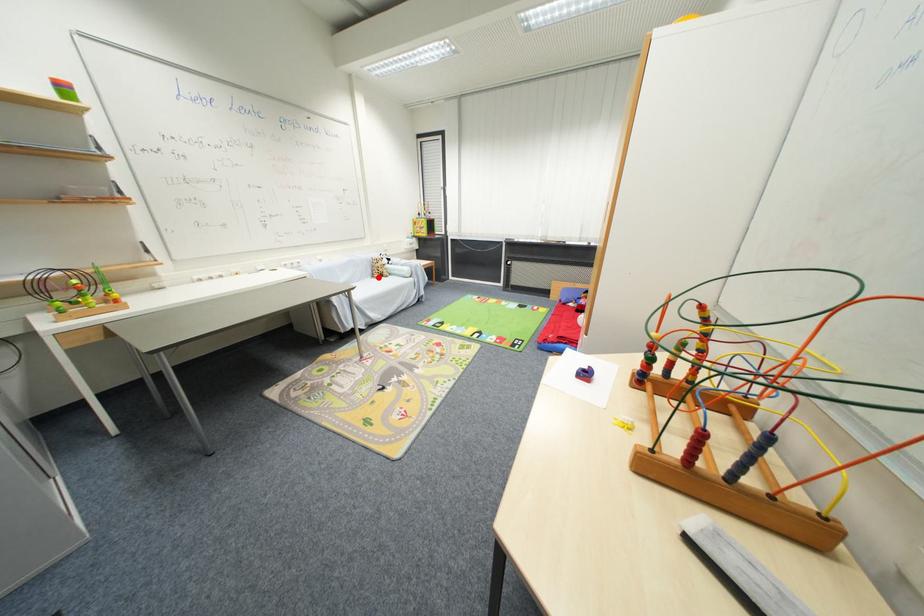
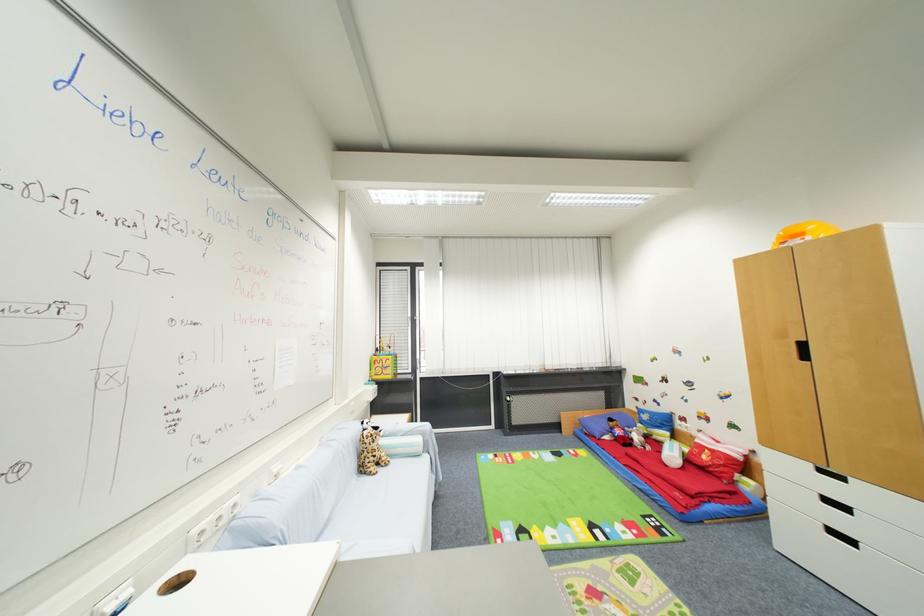
Question: I am providing you with two images of the same scene from different viewpoints. Given a red point in image1, look at the same physical point in image2. Is it:

Choices:
 (A) Closer to the viewpoint
 (B) Farther from the viewpoint

Answer: (B)